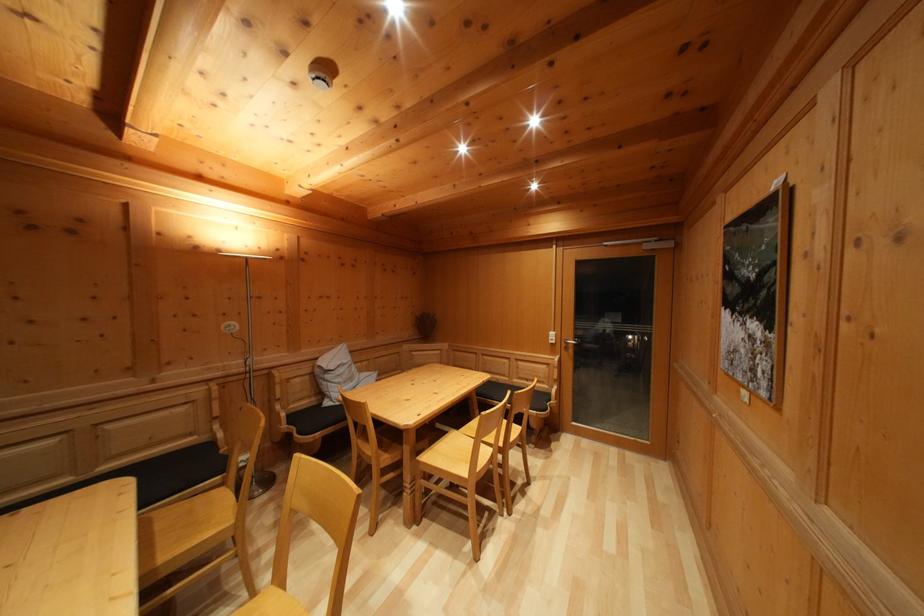
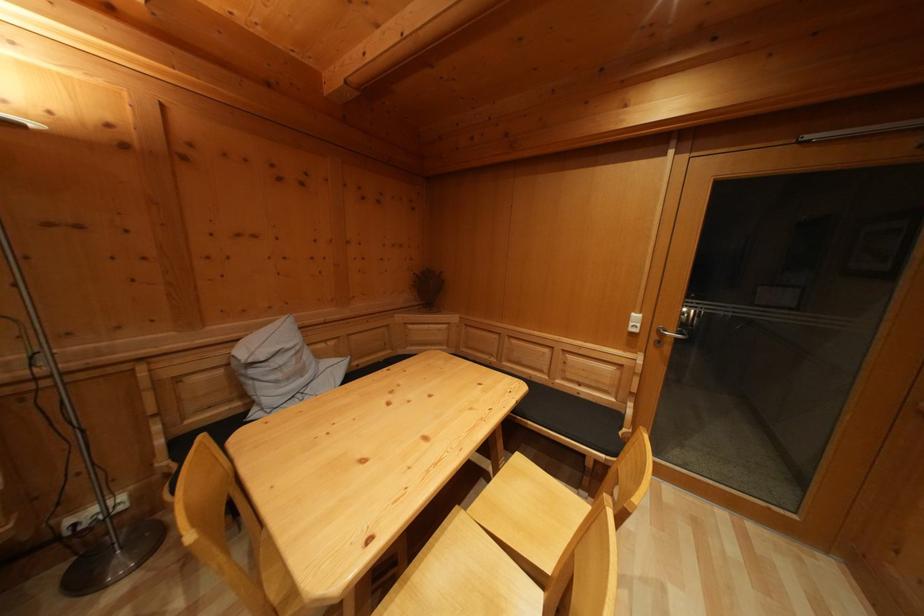
Question: The images are taken continuously from a first-person perspective. In which direction are you moving?

Choices:
 (A) Left
 (B) Right
 (C) Forward
 (D) Backward

Answer: (C)